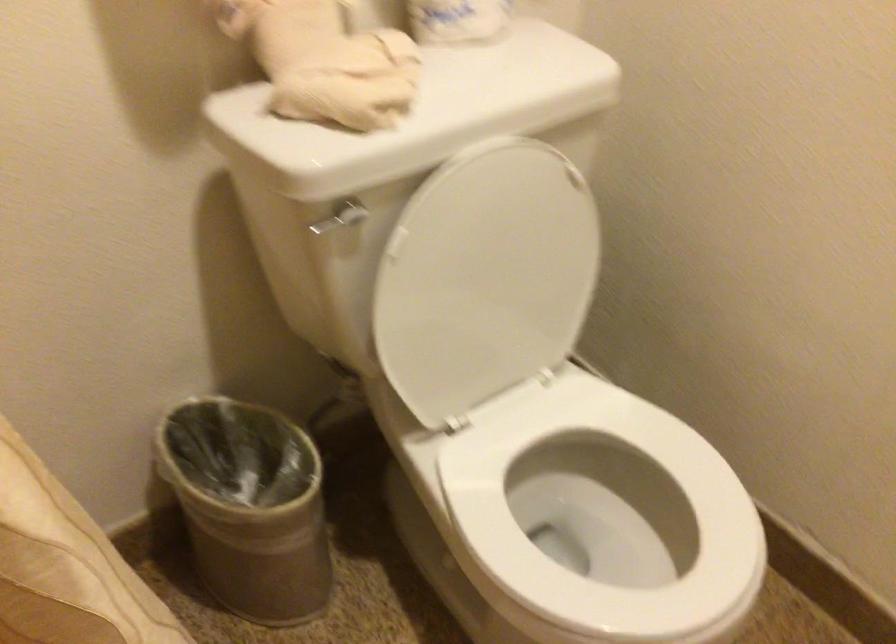
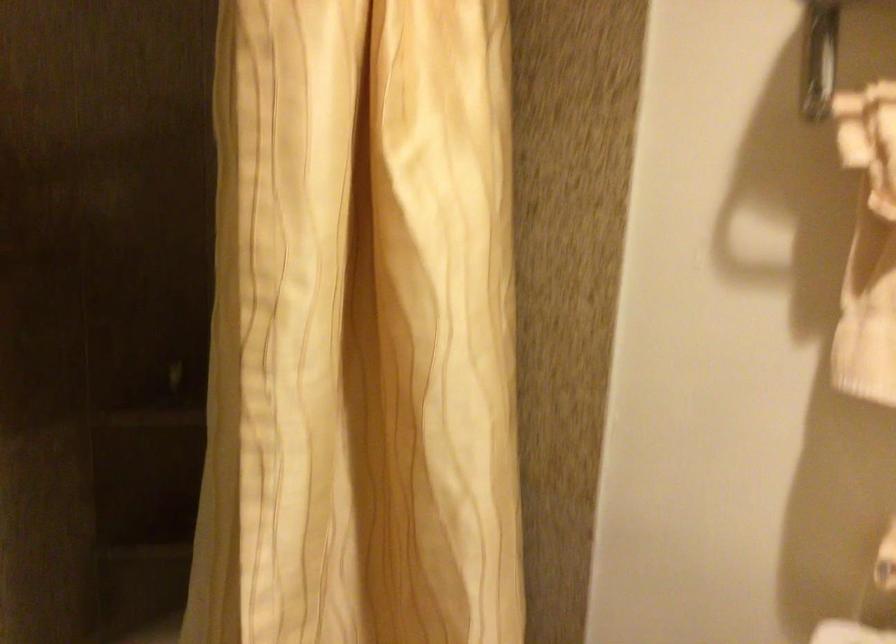
Question: The camera is either moving clockwise (left) or counter-clockwise (right) around the object. The first image is from the beginning of the video and the second image is from the end. Is the camera moving left or right when shooting the video?

Choices:
 (A) Left
 (B) Right

Answer: (B)